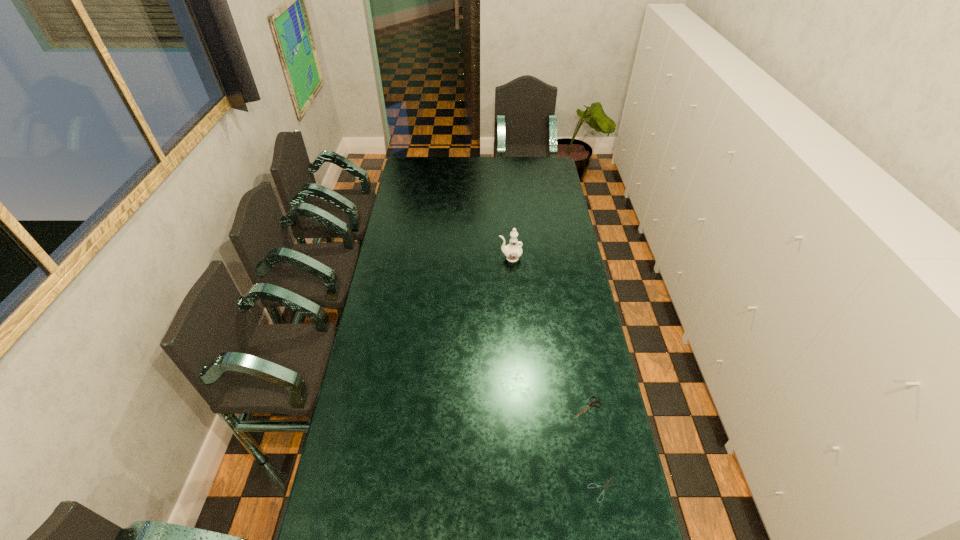
Identify the location of free spot that satisfies the following two spatial constraints: 1. on the front side of the nearer shears; 2. on the right side of the second tallest object. Image resolution: width=960 pixels, height=540 pixels. (603, 489).

Find the location of `free spot that satisfies the following two spatial constraints: 1. at the spout of the chinaware; 2. on the right side of the second nearest object`. free spot that satisfies the following two spatial constraints: 1. at the spout of the chinaware; 2. on the right side of the second nearest object is located at coordinates (520, 407).

What are the coordinates of `blank space that satisfies the following two spatial constraints: 1. at the spout of the farthest object; 2. on the left side of the taller shears` in the screenshot? It's located at (520, 407).

Locate an element on the screen. The image size is (960, 540). blank area in the image that satisfies the following two spatial constraints: 1. at the spout of the second tallest object; 2. on the right side of the farthest object is located at coordinates (520, 407).

Where is `free space that satisfies the following two spatial constraints: 1. on the back side of the farther shears; 2. at the spout of the tallest object`? This screenshot has width=960, height=540. free space that satisfies the following two spatial constraints: 1. on the back side of the farther shears; 2. at the spout of the tallest object is located at coordinates (560, 258).

Locate an element on the screen. The height and width of the screenshot is (540, 960). free space that satisfies the following two spatial constraints: 1. on the front side of the second farthest object; 2. on the left side of the shorter shears is located at coordinates (603, 489).

At what (x,y) coordinates should I click in order to perform the action: click on free space that satisfies the following two spatial constraints: 1. on the back side of the farther shears; 2. at the spout of the tallest object. Please return your answer as a coordinate pair (x, y). Looking at the image, I should click on (560, 258).